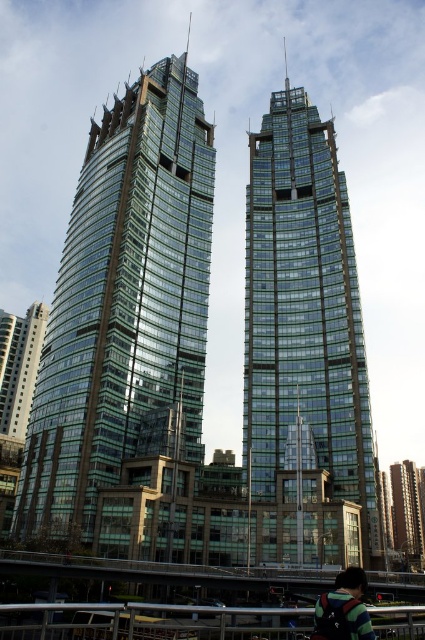
You are standing in a park across from the two green glass buildings. You want to take a photo of the green glass building at lower right without the green glass building at lower left blocking it. Is it possible to do so by moving to the right side of the park?

The green glass building at lower left is in front of the green glass building at lower right. Since you are moving to the right side of the park, you can position yourself to the right of the green glass building at lower left, allowing you to see the green glass building at lower right behind it. Therefore, it is possible to take the photo without obstruction.

You are a photographer standing in the middle of the city park. You want to capture both the transparent glass skyscraper at center and the dark green backpack at lower right in a single shot. Which object should you frame first to ensure both are visible in your photo?

You should frame the transparent glass skyscraper at center first because its width surpasses the dark green backpack at lower right, so positioning it first ensures there is enough space for both in the frame.